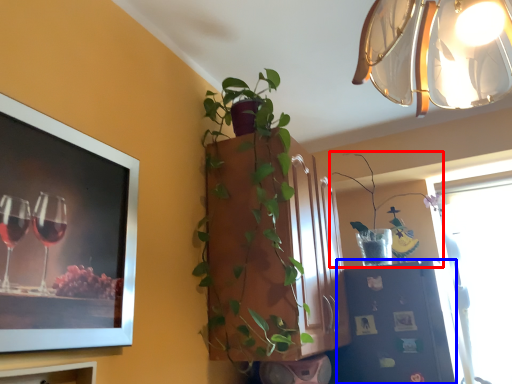
Question: Which object appears closest to the camera in this image, houseplant (highlighted by a red box) or shelf (highlighted by a blue box)?

Choices:
 (A) houseplant
 (B) shelf

Answer: (B)